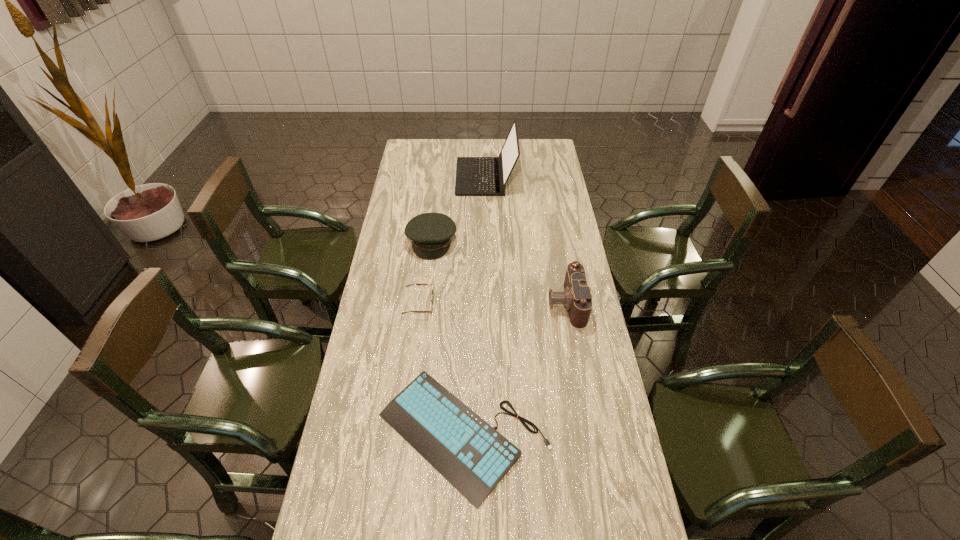
The height and width of the screenshot is (540, 960). What are the coordinates of `vacant space situated on the surface of the farthest object` in the screenshot? It's located at (430, 177).

The image size is (960, 540). Find the location of `vacant space situated on the surface of the farthest object`. vacant space situated on the surface of the farthest object is located at coordinates (423, 177).

Identify the location of vacant space located 0.080m on the front-facing side of the fourth shortest object. The width and height of the screenshot is (960, 540). (525, 303).

Find the location of a particular element. free space located on the front-facing side of the fourth shortest object is located at coordinates (534, 303).

I want to click on vacant area located 0.130m on the front-facing side of the fourth shortest object, so click(x=512, y=303).

Locate an element on the screen. The width and height of the screenshot is (960, 540). free point located 0.120m on the front-facing side of the second farthest object is located at coordinates (427, 282).

Find the location of a particular element. This screenshot has width=960, height=540. vacant space located on the frame of the fourth tallest object is located at coordinates (456, 304).

Where is `vacant region located on the back of the nearest object`? Image resolution: width=960 pixels, height=540 pixels. vacant region located on the back of the nearest object is located at coordinates (466, 341).

Where is `object positioned at the far edge`? The width and height of the screenshot is (960, 540). object positioned at the far edge is located at coordinates (475, 176).

You are a GUI agent. You are given a task and a screenshot of the screen. Output one action in this format:
    pyautogui.click(x=<x>, y=<y>)
    Task: Click on the beret present at the left edge
    This screenshot has width=960, height=540.
    Given the screenshot: What is the action you would take?
    pyautogui.click(x=431, y=233)